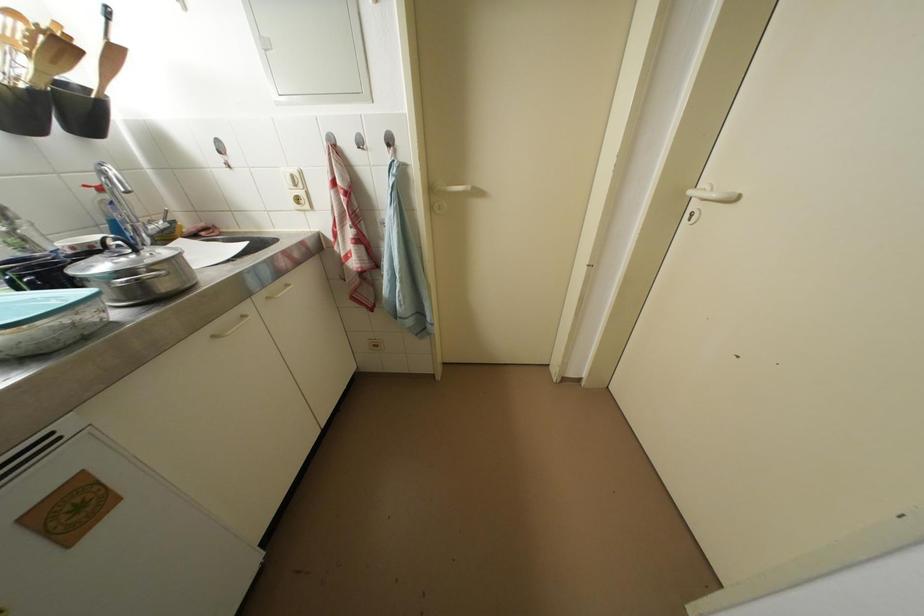
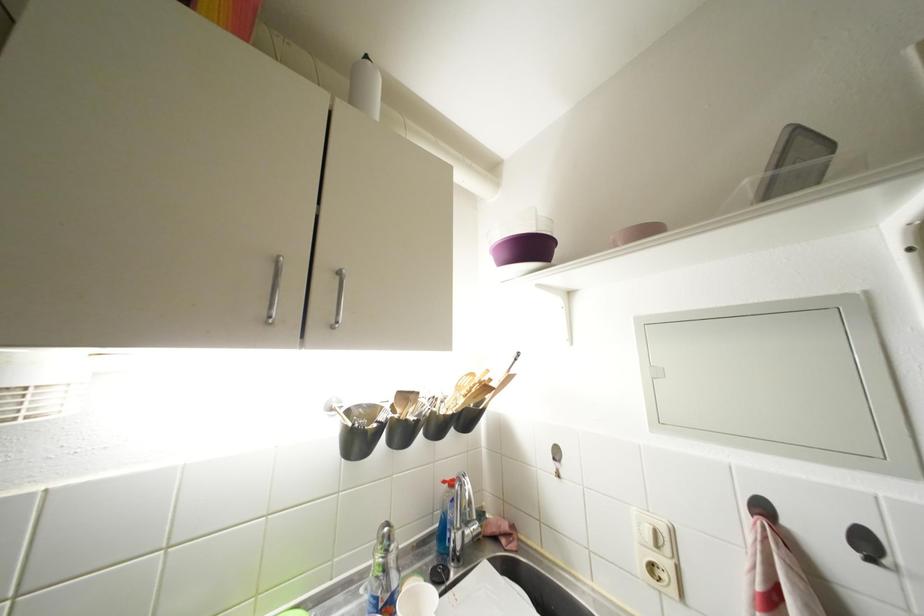
In the second image, find the point that corresponds to (226,161) in the first image.

(560, 469)